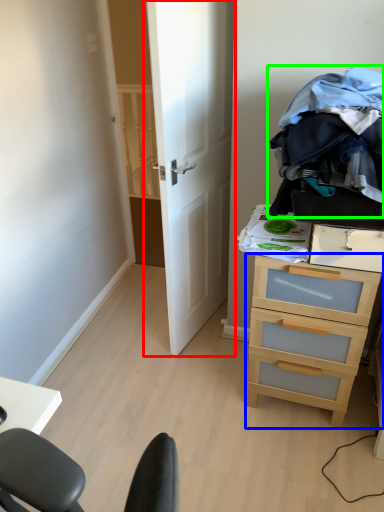
Question: Which is farther away from door (highlighted by a red box)? chest of drawers (highlighted by a blue box) or clothing (highlighted by a green box)?

Choices:
 (A) chest of drawers
 (B) clothing

Answer: (A)